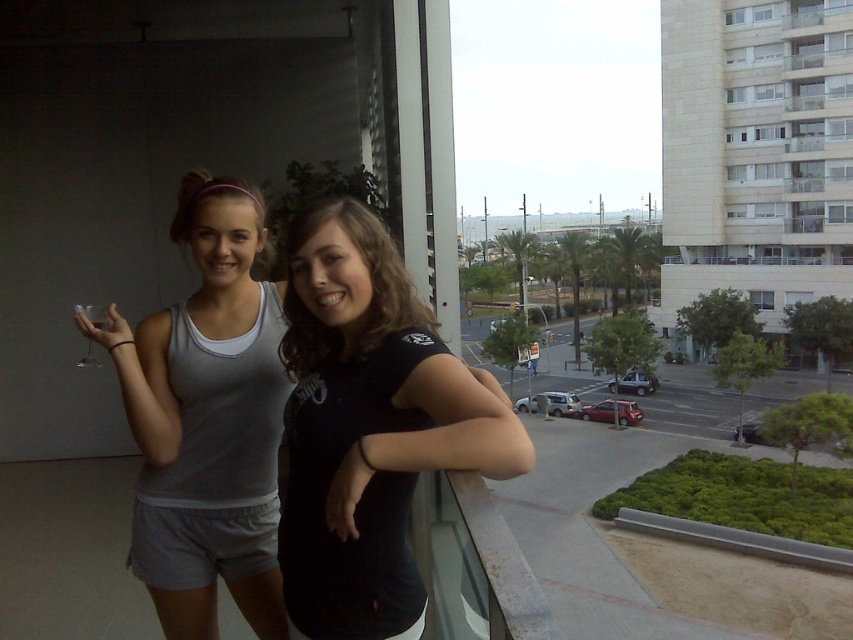
Which is above, black matte t-shirt at center or gray fabric tank top at left?

black matte t-shirt at center is above.

Is point (289, 538) more distant than point (189, 451)?

No.

Is point (346, 360) positioned after point (227, 189)?

No, (346, 360) is in front of (227, 189).

Where is `black matte t-shirt at center`? Image resolution: width=853 pixels, height=640 pixels. black matte t-shirt at center is located at coordinates (369, 428).